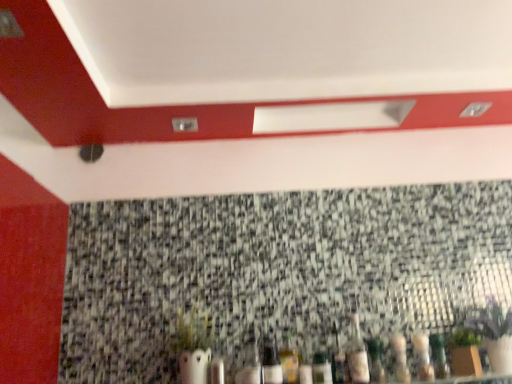
Question: From the image's perspective, relative to clear glass bottle at center, acting as the seventh bottle starting from the right, is translucent glass bottle at lower right, which is the 6th bottle in left-to-right order, above or below?

Choices:
 (A) below
 (B) above

Answer: (B)

Question: Based on their sizes in the image, would you say translucent glass bottle at lower right, the 2th bottle when ordered from right to left, is bigger or smaller than clear glass bottle at center, which appears as the 1th bottle when viewed from the left?

Choices:
 (A) big
 (B) small

Answer: (A)

Question: Estimate the real-world distances between objects in this image. Which object is closer to the translucent glass bottle at lower right, the 2th bottle when ordered from right to left?

Choices:
 (A) translucent glass bottle at center, the 5th bottle in the left-to-right sequence
 (B) clear glass bottle at center, the fourth bottle in the left-to-right sequence
 (C) clear glass bottle at center, which appears as the 1th bottle when viewed from the left
 (D) granite mosaic at center
 (E) white matte vase at lower center

Answer: (A)

Question: Which object is positioned closest to the translucent glass bottle at lower right, marked as the first bottle in a right-to-left arrangement?

Choices:
 (A) translucent glass bottle at lower right, which is the 6th bottle in left-to-right order
 (B) translucent glass bottle at center, the 5th bottle in the left-to-right sequence
 (C) clear glass bottle at center, which ranks as the fourth bottle in right-to-left order
 (D) translucent glass bottle at lower center, arranged as the 6th bottle when viewed from the right
 (E) white matte vase at lower center

Answer: (A)